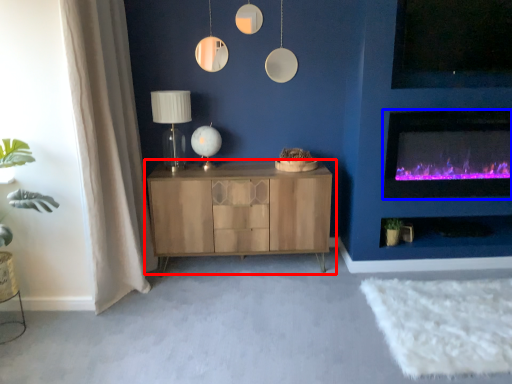
Question: Among these objects, which one is farthest to the camera, cabinetry (highlighted by a red box) or wood burning stove (highlighted by a blue box)?

Choices:
 (A) cabinetry
 (B) wood burning stove

Answer: (A)